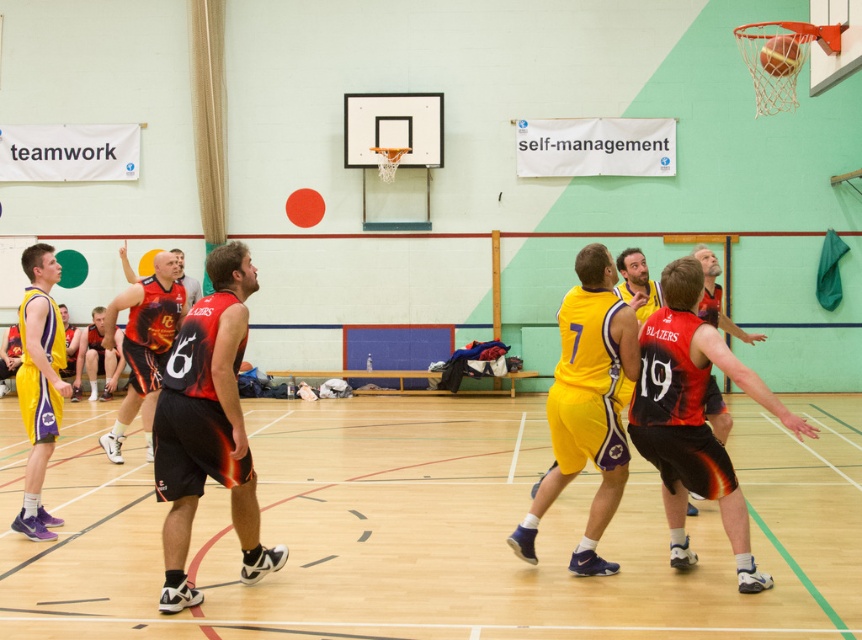
You are a spectator sitting at the back of the gymnasium and you see two points marked on the court. The first point is at coordinate point (76, 451) and the second point is at coordinate point (138, 280). Which point is closer to you?

Point (76, 451) is closer to you because it is further to the viewer than point (138, 280).